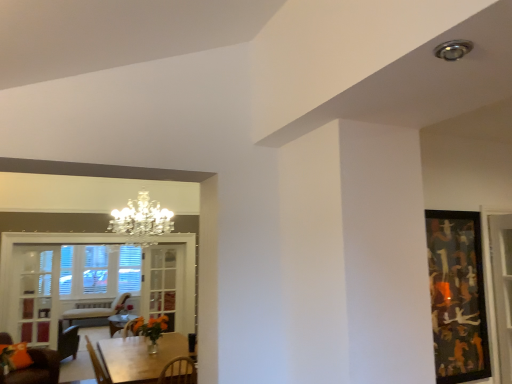
Question: Is abstract painting at right to the right of wooden table at lower left from the viewer's perspective?

Choices:
 (A) yes
 (B) no

Answer: (A)

Question: Does abstract painting at right appear on the left side of wooden table at lower left?

Choices:
 (A) yes
 (B) no

Answer: (B)

Question: Is abstract painting at right aimed at wooden table at lower left?

Choices:
 (A) no
 (B) yes

Answer: (A)

Question: Is abstract painting at right far from wooden table at lower left?

Choices:
 (A) no
 (B) yes

Answer: (B)

Question: From the image's perspective, is abstract painting at right above wooden table at lower left?

Choices:
 (A) no
 (B) yes

Answer: (B)

Question: Does abstract painting at right have a smaller size compared to wooden table at lower left?

Choices:
 (A) no
 (B) yes

Answer: (B)

Question: Does wooden table at lower left lie behind orange matte vase at center?

Choices:
 (A) no
 (B) yes

Answer: (A)

Question: From a real-world perspective, does wooden table at lower left sit lower than orange matte vase at center?

Choices:
 (A) no
 (B) yes

Answer: (B)

Question: From a real-world perspective, is wooden table at lower left located higher than orange matte vase at center?

Choices:
 (A) yes
 (B) no

Answer: (B)

Question: Does wooden table at lower left appear on the right side of orange matte vase at center?

Choices:
 (A) yes
 (B) no

Answer: (A)

Question: From the image's perspective, is wooden table at lower left located beneath orange matte vase at center?

Choices:
 (A) no
 (B) yes

Answer: (B)

Question: Is wooden table at lower left bigger than orange matte vase at center?

Choices:
 (A) yes
 (B) no

Answer: (A)

Question: Does clear glass cabinet at left, acting as the 1th glass door starting from the front, have a lesser width compared to clear glass window at lower left?

Choices:
 (A) no
 (B) yes

Answer: (B)